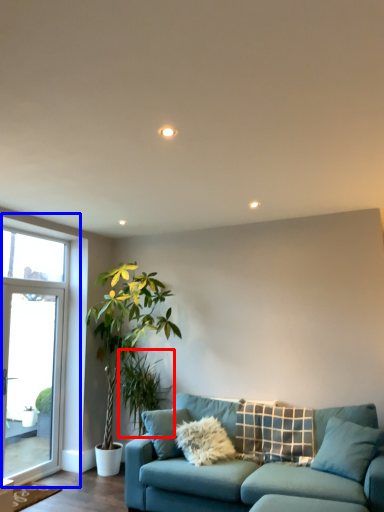
Question: Which object is closer to the camera taking this photo, plant (highlighted by a red box) or window (highlighted by a blue box)?

Choices:
 (A) plant
 (B) window

Answer: (B)